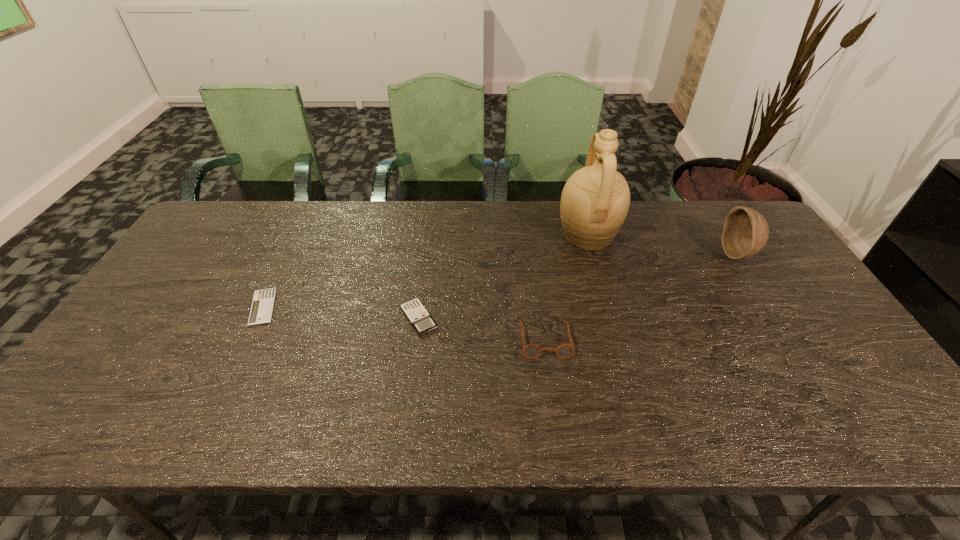
This screenshot has height=540, width=960. Find the location of `the fourth object from left to right`. the fourth object from left to right is located at coordinates (595, 200).

Locate an element on the screen. pitcher is located at coordinates (595, 200).

At what (x,y) coordinates should I click in order to perform the action: click on the fourth shortest object. Please return your answer as a coordinate pair (x, y). Looking at the image, I should click on (745, 232).

Locate an element on the screen. This screenshot has width=960, height=540. bowl is located at coordinates (745, 232).

Where is `spectacles`? spectacles is located at coordinates (532, 351).

Image resolution: width=960 pixels, height=540 pixels. I want to click on the third object from left to right, so click(x=532, y=351).

Where is `the taller calculator`? the taller calculator is located at coordinates (421, 320).

You are a GUI agent. You are given a task and a screenshot of the screen. Output one action in this format:
    pyautogui.click(x=<x>, y=<y>)
    Task: Click on the fourth object from right to left
    This screenshot has height=540, width=960.
    Given the screenshot: What is the action you would take?
    pyautogui.click(x=421, y=320)

In order to click on the shorter calculator in this screenshot , I will do `click(261, 310)`.

Identify the location of the shortest object. The height and width of the screenshot is (540, 960). (261, 310).